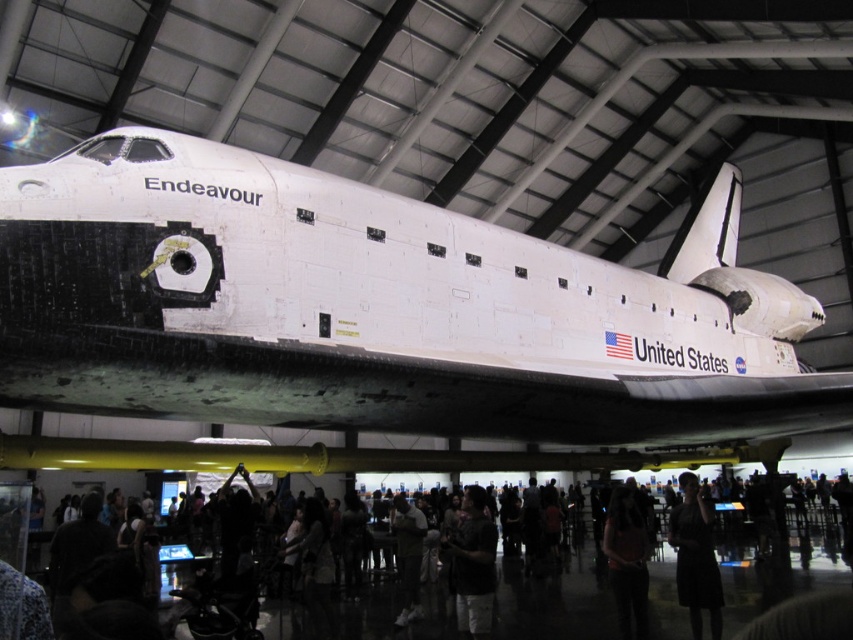
You are an astronaut preparing for a spacewalk and need to identify your position relative to other crew members. If you are standing at the dark gray fabric shirt at center, which direction should you move to avoid the dark clothing crowd at lower center?

Since the dark clothing crowd at lower center is positioned under the dark gray fabric shirt at center, you should move upward to avoid them.

You are a photographer trying to capture a clear photo of the Endeavour shuttle. There are two groups in your way. The dark clothing crowd at lower center and the matte pink shirt at center. Which group is blocking your view more?

The dark clothing crowd at lower center is blocking your view more because it is much taller than the matte pink shirt at center.

You are a photographer standing in front of the Endeavour shuttle. You want to take a picture of the matte pink shirt at center without any people in the frame. The dark clothing crowd at lower center is blocking your view. Can you step back enough to capture the shirt without the crowd blocking it?

The dark clothing crowd at lower center is 9.21 meters away from the matte pink shirt at center. Since the crowd is 9.21 meters behind the shirt, stepping back might not help as the distance between them is already significant. However, without knowing the exact positions and angles, it is uncertain. Consider moving sideways or adjusting the camera angle to avoid the crowd.